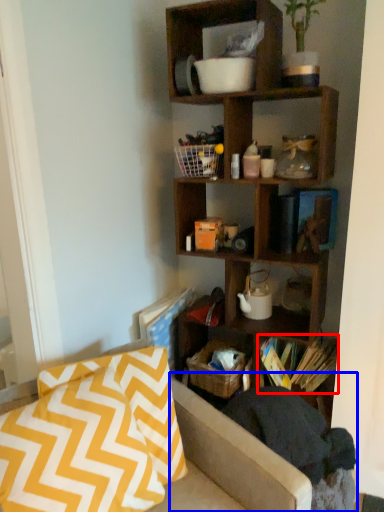
Question: Which point is closer to the camera, book (highlighted by a red box) or swivel chair (highlighted by a blue box)?

Choices:
 (A) book
 (B) swivel chair

Answer: (B)